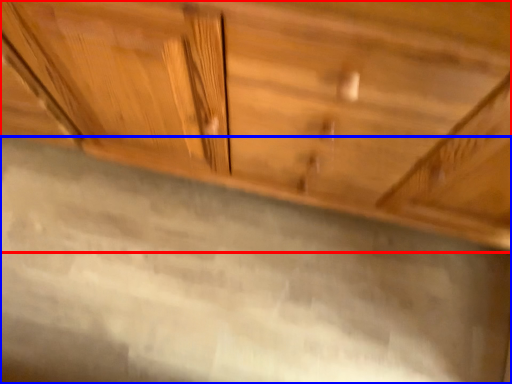
Question: Which point is closer to the camera, cabinetry (highlighted by a red box) or granite (highlighted by a blue box)?

Choices:
 (A) cabinetry
 (B) granite

Answer: (A)